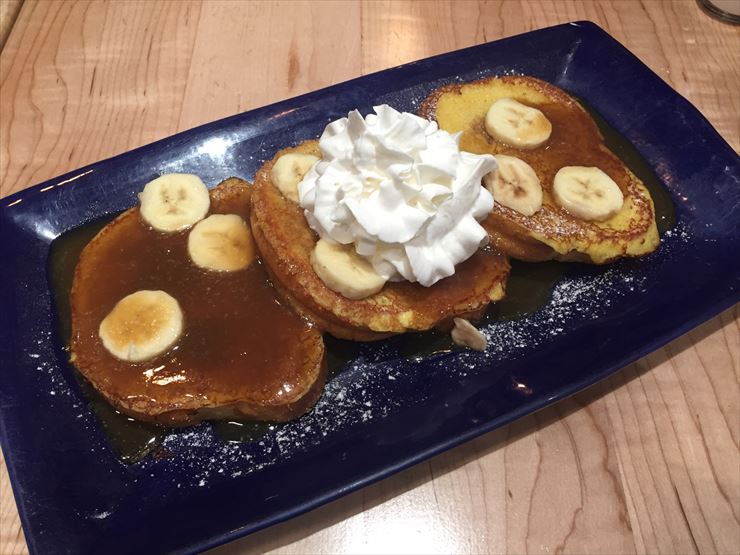
This screenshot has width=740, height=555. Find the location of `plate`. plate is located at coordinates (440, 431).